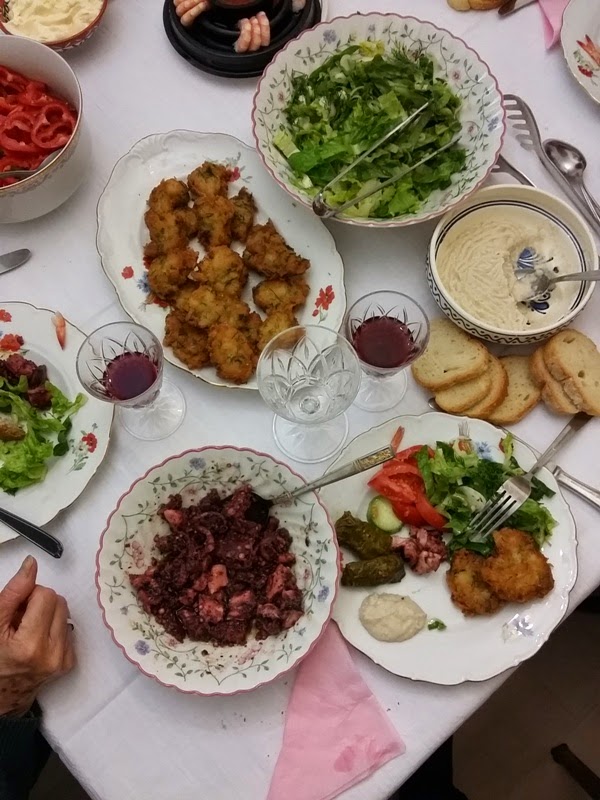
This screenshot has width=600, height=800. I want to click on empty glass, so click(x=322, y=442).